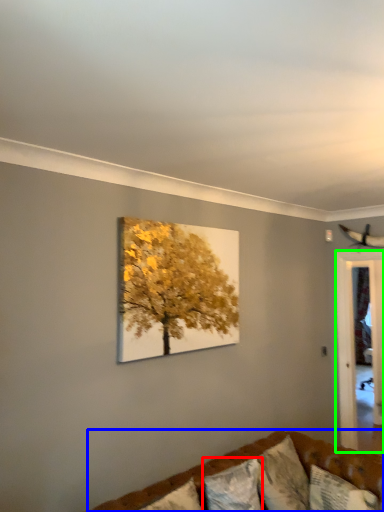
Question: Estimate the real-world distances between objects in this image. Which object is closer to pillow (highlighted by a red box), studio couch (highlighted by a blue box) or glass door (highlighted by a green box)?

Choices:
 (A) studio couch
 (B) glass door

Answer: (A)